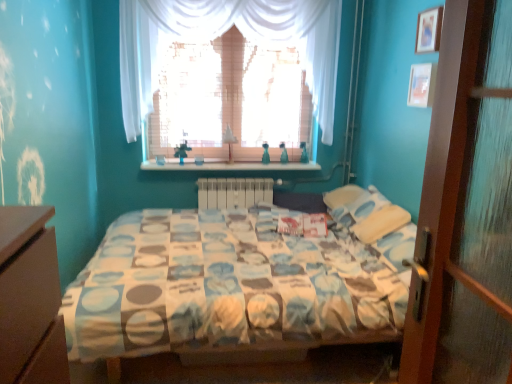
Question: Does point (430, 104) appear closer or farther from the camera than point (244, 31)?

Choices:
 (A) farther
 (B) closer

Answer: (B)

Question: Based on their positions, is wooden picture frame at upper right, the 1th picture frame when ordered from bottom to top, located to the left or right of white sheer curtain at upper center?

Choices:
 (A) right
 (B) left

Answer: (A)

Question: Considering the real-world distances, which object is closest to the white sheer curtain at upper center?

Choices:
 (A) white plastic radiator at center
 (B) wooden shelf at center
 (C) wooden picture frame at upper right, which appears as the second picture frame when ordered from the bottom
 (D) wooden picture frame at upper right, the 1th picture frame when ordered from bottom to top

Answer: (B)

Question: Which object is positioned closest to the wooden picture frame at upper right, which is the first picture frame from top to bottom?

Choices:
 (A) wooden picture frame at upper right, the 2th picture frame positioned from the top
 (B) white plastic radiator at center
 (C) wooden shelf at center
 (D) white sheer curtain at upper center

Answer: (A)